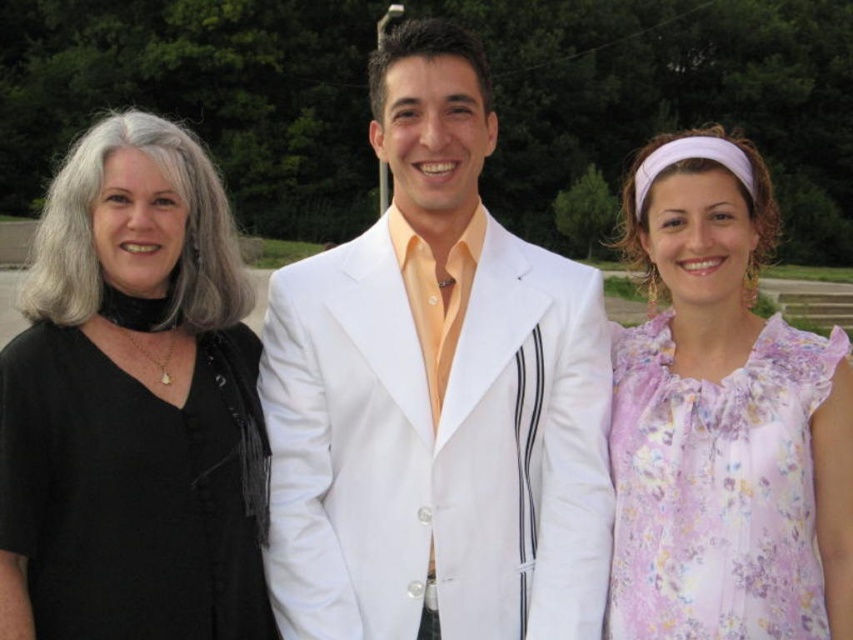
Question: Considering the relative positions of black matte shirt at left and floral chiffon blouse at right in the image provided, where is black matte shirt at left located with respect to floral chiffon blouse at right?

Choices:
 (A) right
 (B) left

Answer: (B)

Question: Does white satin suit at center have a smaller size compared to floral chiffon blouse at right?

Choices:
 (A) yes
 (B) no

Answer: (A)

Question: Which object is closer to the camera taking this photo?

Choices:
 (A) black matte shirt at left
 (B) floral chiffon blouse at right
 (C) white satin suit at center

Answer: (A)

Question: Which object appears closest to the camera in this image?

Choices:
 (A) floral chiffon blouse at right
 (B) white satin suit at center
 (C) black matte shirt at left

Answer: (C)

Question: Which object is positioned farthest from the white satin suit at center?

Choices:
 (A) black matte shirt at left
 (B) floral chiffon blouse at right

Answer: (A)

Question: From the image, what is the correct spatial relationship of white satin suit at center in relation to floral chiffon blouse at right?

Choices:
 (A) below
 (B) above

Answer: (A)